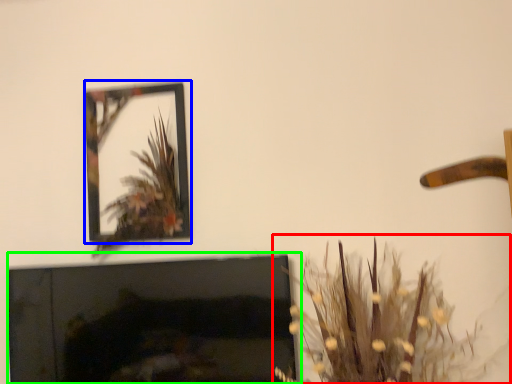
Question: Based on their relative distances, which object is farther from houseplant (highlighted by a red box)? Choose from picture frame (highlighted by a blue box) and fireplace (highlighted by a green box).

Choices:
 (A) picture frame
 (B) fireplace

Answer: (A)